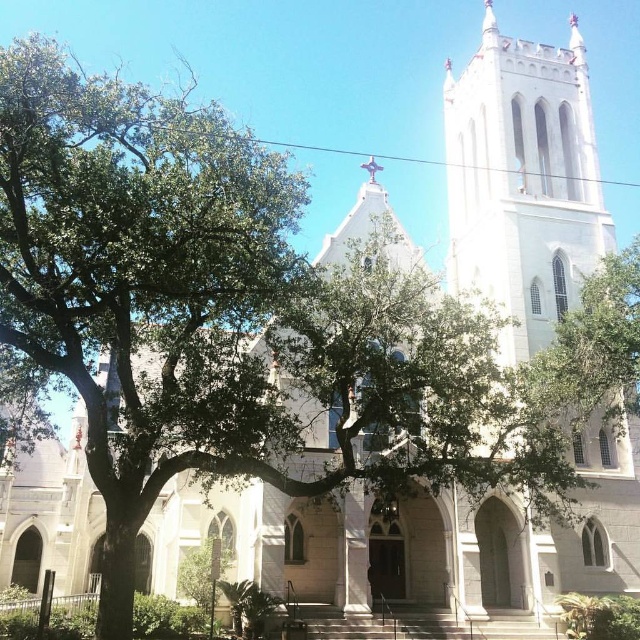
Does white stone tower at upper right have a lesser width compared to green leafy tree at upper right?

No.

Identify the location of white stone tower at upper right. Image resolution: width=640 pixels, height=640 pixels. pyautogui.click(x=522, y=180).

Where is `white stone tower at upper right`? white stone tower at upper right is located at coordinates (522, 180).